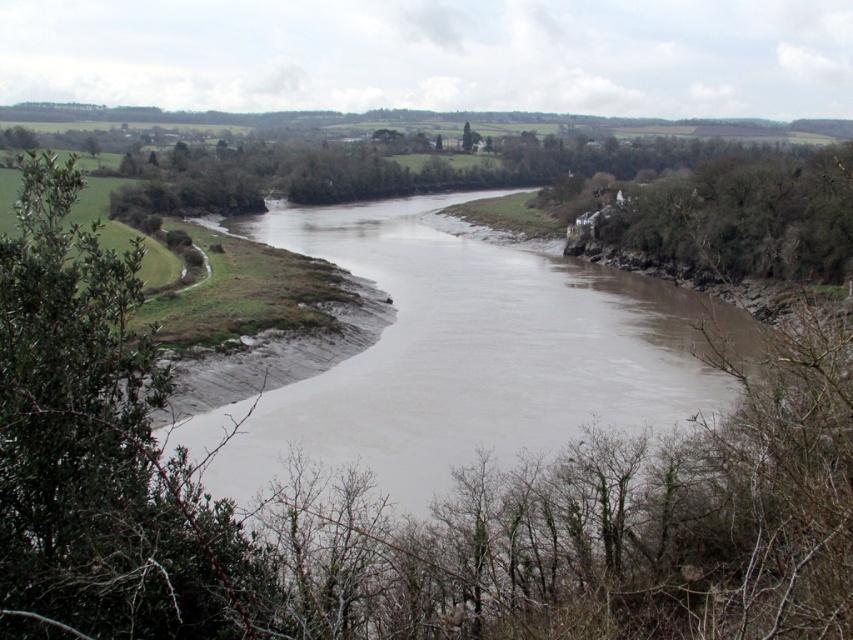
Who is positioned more to the left, muddy water at center or green leafy bush at left?

From the viewer's perspective, green leafy bush at left appears more on the left side.

Is point (293, 356) positioned behind point (180, 589)?

Yes.

This screenshot has width=853, height=640. Identify the location of muddy water at center. (463, 353).